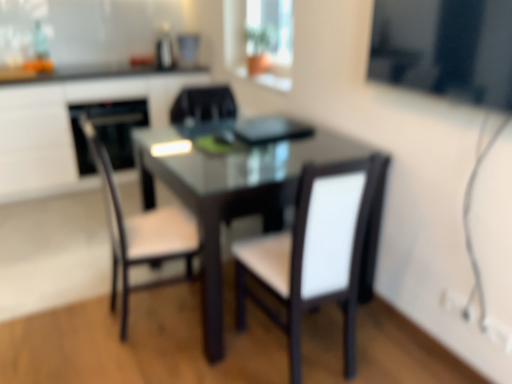
Find the location of a particular element. Image resolution: width=512 pixels, height=384 pixels. black matte chair at center, which appears as the second chair when viewed from the right is located at coordinates (203, 106).

What do you see at coordinates (203, 106) in the screenshot?
I see `black matte chair at center, the second chair in the left-to-right sequence` at bounding box center [203, 106].

The height and width of the screenshot is (384, 512). Find the location of `matte black desk at center`. matte black desk at center is located at coordinates (68, 127).

Image resolution: width=512 pixels, height=384 pixels. What do you see at coordinates (68, 127) in the screenshot?
I see `matte black desk at center` at bounding box center [68, 127].

This screenshot has width=512, height=384. I want to click on black glossy oven at left, so click(x=108, y=131).

At what (x,y) coordinates should I click in order to perform the action: click on white leather chair at center, the first chair from the right. Please return your answer as a coordinate pair (x, y). Image resolution: width=512 pixels, height=384 pixels. Looking at the image, I should click on (314, 252).

Which is closer, (336,287) or (179,106)?

Point (336,287) is positioned closer to the camera compared to point (179,106).

Is white leather chair at center, the first chair from the right, wider or thinner than black matte chair at center, the second chair in the left-to-right sequence?

white leather chair at center, the first chair from the right, is wider than black matte chair at center, the second chair in the left-to-right sequence.

From the image's perspective, is transparent glass window screen at upper right, marked as the second window screen in a top-to-bottom arrangement, located above matte black desk at center?

Actually, transparent glass window screen at upper right, marked as the second window screen in a top-to-bottom arrangement, appears below matte black desk at center in the image.

Based on the photo, who is bigger, transparent glass window screen at upper right, placed as the 1th window screen when sorted from right to left, or matte black desk at center?

matte black desk at center is bigger.

Considering the sizes of transparent glass window screen at upper right, which appears as the 1th window screen when ordered from the bottom, and matte black desk at center in the image, is transparent glass window screen at upper right, which appears as the 1th window screen when ordered from the bottom, taller or shorter than matte black desk at center?

transparent glass window screen at upper right, which appears as the 1th window screen when ordered from the bottom, is shorter than matte black desk at center.

Considering the sizes of objects transparent glass window screen at upper right, the 2th window screen from the left, and matte black desk at center in the image provided, who is thinner, transparent glass window screen at upper right, the 2th window screen from the left, or matte black desk at center?

Thinner between the two is transparent glass window screen at upper right, the 2th window screen from the left.

From a real-world perspective, is transparent glass window screen at upper right, marked as the second window screen in a top-to-bottom arrangement, positioned above or below white leather chair at center, the third chair positioned from the left?

From a real-world perspective, transparent glass window screen at upper right, marked as the second window screen in a top-to-bottom arrangement, is physically above white leather chair at center, the third chair positioned from the left.

Considering the sizes of transparent glass window screen at upper right, which is the second window screen from back to front, and white leather chair at center, the third chair positioned from the left, in the image, is transparent glass window screen at upper right, which is the second window screen from back to front, bigger or smaller than white leather chair at center, the third chair positioned from the left,?

transparent glass window screen at upper right, which is the second window screen from back to front, is smaller than white leather chair at center, the third chair positioned from the left.

How many degrees apart are the facing directions of transparent glass window screen at upper right, which appears as the 1th window screen when ordered from the bottom, and white leather chair at center, the third chair positioned from the left?

The facing directions of transparent glass window screen at upper right, which appears as the 1th window screen when ordered from the bottom, and white leather chair at center, the third chair positioned from the left, are 95.8 degrees apart.

Is transparent glass window screen at upper right, the 2th window screen from the left, not near white leather chair at center, the first chair from the right?

No, transparent glass window screen at upper right, the 2th window screen from the left, is in close proximity to white leather chair at center, the first chair from the right.

From a real-world perspective, starting from the black matte chair at center, the second chair in the left-to-right sequence, which chair is the 1st one below it? Please provide its 2D coordinates.

[(138, 222)]

Consider the image. Could you tell me if black matte chair at center, which appears as the second chair when viewed from the right, is turned towards white matte chair at center, which is counted as the third chair, starting from the right?

No, black matte chair at center, which appears as the second chair when viewed from the right, is not aimed at white matte chair at center, which is counted as the third chair, starting from the right.

Based on the photo, who is taller, black matte chair at center, which appears as the second chair when viewed from the right, or white matte chair at center, which is the 1th chair in left-to-right order?

With more height is white matte chair at center, which is the 1th chair in left-to-right order.

From the image's perspective, is black matte chair at center, the second chair in the left-to-right sequence, below white matte chair at center, which is the 1th chair in left-to-right order?

No, from the image's perspective, black matte chair at center, the second chair in the left-to-right sequence, is not below white matte chair at center, which is the 1th chair in left-to-right order.

Is there a large distance between matte black desk at center and white matte chair at center, which is the 1th chair in left-to-right order?

Yes, matte black desk at center is far from white matte chair at center, which is the 1th chair in left-to-right order.

From the image's perspective, between matte black desk at center and white matte chair at center, which is the 1th chair in left-to-right order, who is located below?

white matte chair at center, which is the 1th chair in left-to-right order.

Which chair is the 1st one when counting from the right side of the matte black desk at center? Please provide its 2D coordinates.

[(138, 222)]

Does white matte chair at center, which is the 1th chair in left-to-right order, have a lesser height compared to matte black desk at center?

Incorrect, the height of white matte chair at center, which is the 1th chair in left-to-right order, does not fall short of that of matte black desk at center.

Between white matte chair at center, which is counted as the third chair, starting from the right, and matte black desk at center, which one has larger width?

matte black desk at center.

Looking at this image, in the image, is white matte chair at center, which is counted as the third chair, starting from the right, positioned in front of or behind matte black desk at center?

In the image, white matte chair at center, which is counted as the third chair, starting from the right, appears in front of matte black desk at center.

Based on their positions, is white matte chair at center, which is the 1th chair in left-to-right order, located to the left or right of matte black desk at center?

white matte chair at center, which is the 1th chair in left-to-right order, is positioned on matte black desk at center's right side.

Is transparent glass window screen at upper right, which is the second window screen from back to front, at the right side of matte glass window at upper center, which appears as the second window screen when ordered from the bottom?

Yes.

Between transparent glass window screen at upper right, marked as the second window screen in a top-to-bottom arrangement, and matte glass window at upper center, which ranks as the 1th window screen in left-to-right order, which one has smaller width?

transparent glass window screen at upper right, marked as the second window screen in a top-to-bottom arrangement.

From a real-world perspective, who is located higher, transparent glass window screen at upper right, marked as the second window screen in a top-to-bottom arrangement, or matte glass window at upper center, which appears as the second window screen when ordered from the bottom?

From a 3D spatial view, transparent glass window screen at upper right, marked as the second window screen in a top-to-bottom arrangement, is above.

Is transparent glass window screen at upper right, which is the second window screen from back to front, not within matte glass window at upper center, arranged as the 1th window screen when viewed from the top?

transparent glass window screen at upper right, which is the second window screen from back to front, is positioned outside matte glass window at upper center, arranged as the 1th window screen when viewed from the top.

The image size is (512, 384). Find the location of `the 2nd chair above the white leather chair at center, the third chair positioned from the left (from the image's perspective)`. the 2nd chair above the white leather chair at center, the third chair positioned from the left (from the image's perspective) is located at coordinates (203, 106).

What are the coordinates of `computer desk behind the transparent glass window screen at upper right, marked as the second window screen in a top-to-bottom arrangement` in the screenshot? It's located at (68, 127).

Based on their spatial positions, is matte glass window at upper center, which is the 2th window screen from right to left, or white matte chair at center, which is counted as the third chair, starting from the right, further from black glossy oven at left?

white matte chair at center, which is counted as the third chair, starting from the right, is positioned further to the anchor black glossy oven at left.

Which object lies further to the anchor point black matte chair at center, which appears as the second chair when viewed from the right, matte glass window at upper center, which ranks as the 1th window screen in left-to-right order, or black glossy oven at left?

The object further to black matte chair at center, which appears as the second chair when viewed from the right, is black glossy oven at left.

Which object lies further to the anchor point white leather chair at center, the third chair positioned from the left, transparent glass window screen at upper right, marked as the first window screen in a front-to-back arrangement, or matte black desk at center?

Among the two, matte black desk at center is located further to white leather chair at center, the third chair positioned from the left.

Estimate the real-world distances between objects in this image. Which object is closer to white matte chair at center, which is counted as the third chair, starting from the right, matte black desk at center or transparent glass window screen at upper right, which appears as the 1th window screen when ordered from the bottom?

transparent glass window screen at upper right, which appears as the 1th window screen when ordered from the bottom, is positioned closer to the anchor white matte chair at center, which is counted as the third chair, starting from the right.

Looking at the image, which one is located further to transparent glass window screen at upper right, marked as the first window screen in a front-to-back arrangement, black matte chair at center, the second chair in the left-to-right sequence, or black glossy oven at left?

Among the two, black glossy oven at left is located further to transparent glass window screen at upper right, marked as the first window screen in a front-to-back arrangement.

When comparing their distances from matte glass window at upper center, arranged as the 1th window screen when viewed from the top, does transparent glass window screen at upper right, which is the second window screen from back to front, or black glossy oven at left seem closer?

black glossy oven at left lies closer to matte glass window at upper center, arranged as the 1th window screen when viewed from the top, than the other object.

Considering their positions, is transparent glass window screen at upper right, marked as the first window screen in a front-to-back arrangement, positioned further to white leather chair at center, the third chair positioned from the left, than white matte chair at center, which is counted as the third chair, starting from the right?

transparent glass window screen at upper right, marked as the first window screen in a front-to-back arrangement.

Estimate the real-world distances between objects in this image. Which object is closer to matte black desk at center, black matte chair at center, which appears as the second chair when viewed from the right, or black glossy oven at left?

Based on the image, black glossy oven at left appears to be nearer to matte black desk at center.

The image size is (512, 384). What are the coordinates of `computer desk between white matte chair at center, which is counted as the third chair, starting from the right, and black glossy oven at left in the front-back direction` in the screenshot? It's located at (68, 127).

Find the location of `appliance situated between matte black desk at center and matte glass window at upper center, which is the 2th window screen from right to left, from left to right`. appliance situated between matte black desk at center and matte glass window at upper center, which is the 2th window screen from right to left, from left to right is located at coordinates (108, 131).

Locate an element on the screen. appliance located between matte black desk at center and transparent glass window screen at upper right, marked as the first window screen in a front-to-back arrangement, in the left-right direction is located at coordinates (108, 131).

The width and height of the screenshot is (512, 384). In order to click on window screen between white matte chair at center, which is counted as the third chair, starting from the right, and black glossy oven at left from front to back in this screenshot , I will do `click(260, 38)`.